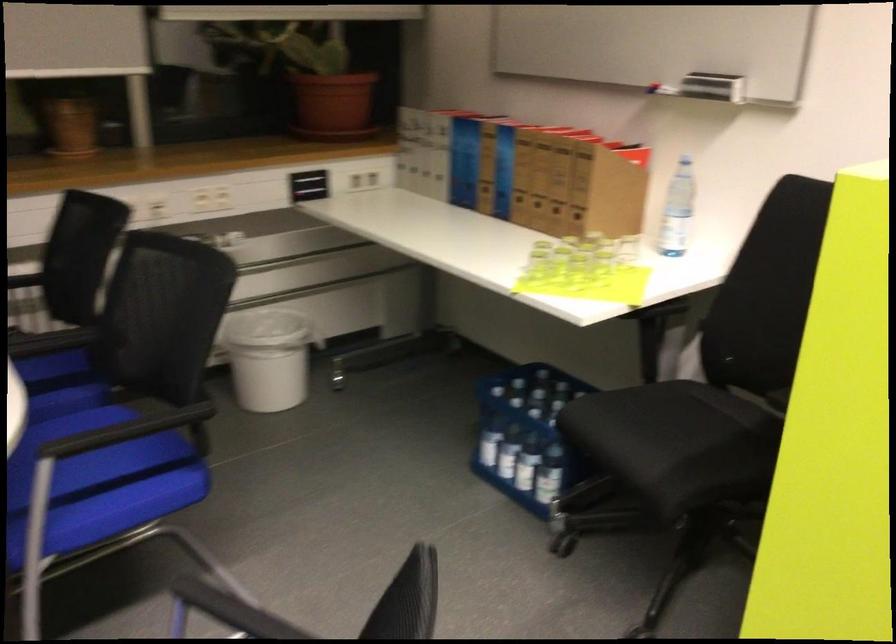
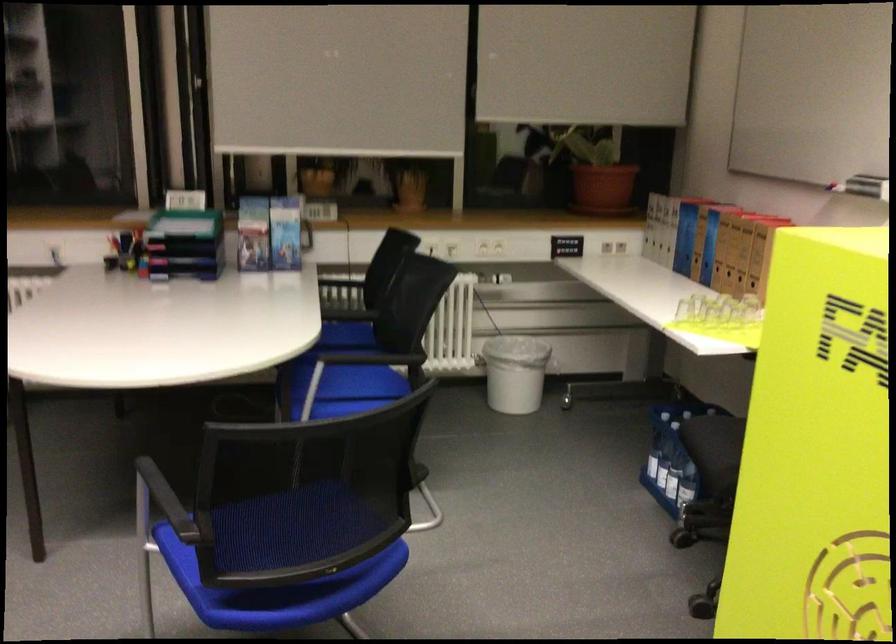
Find the pixel in the second image that matches point 513,458 in the first image.

(667, 471)